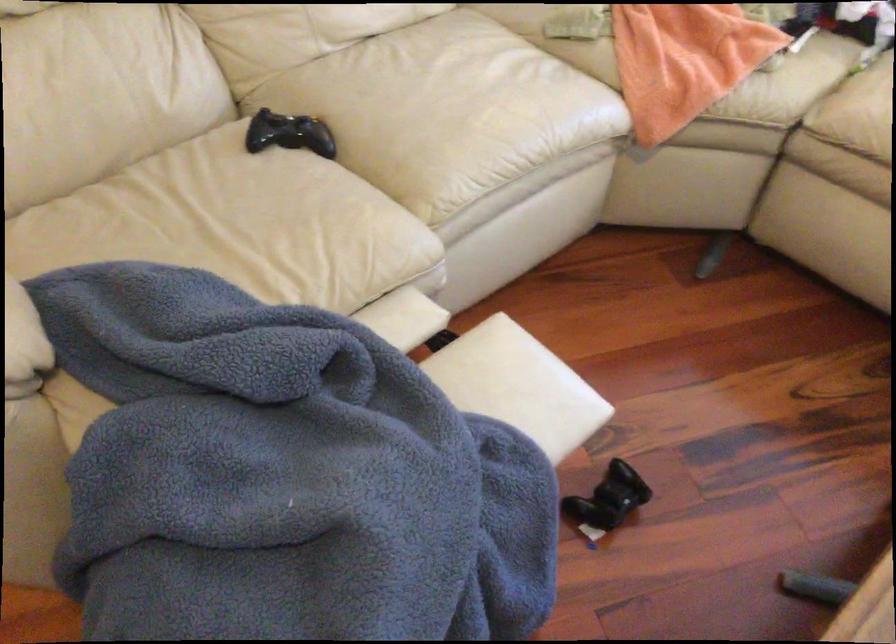
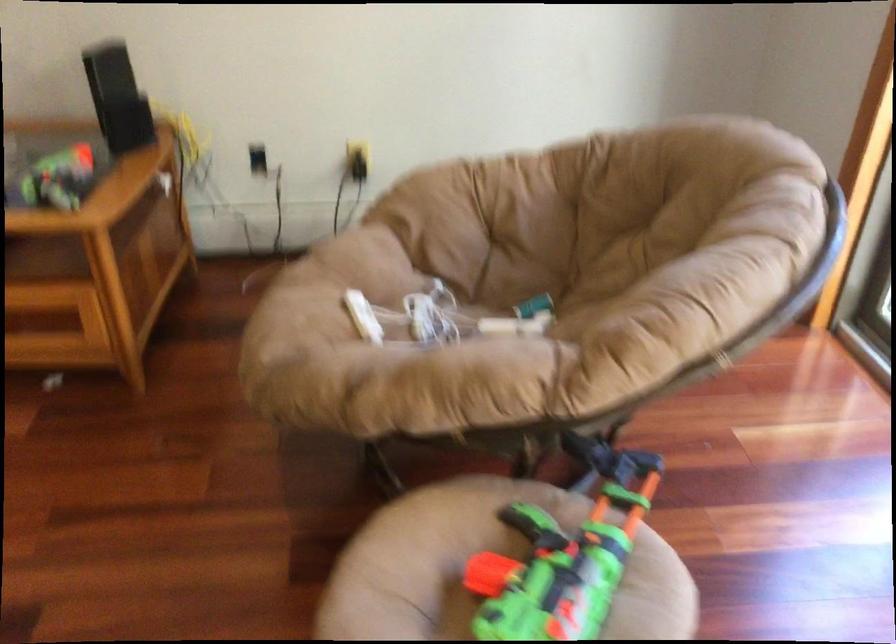
In a continuous first-person perspective shot, in which direction is the camera moving?

The cameraman moved toward right, forward.